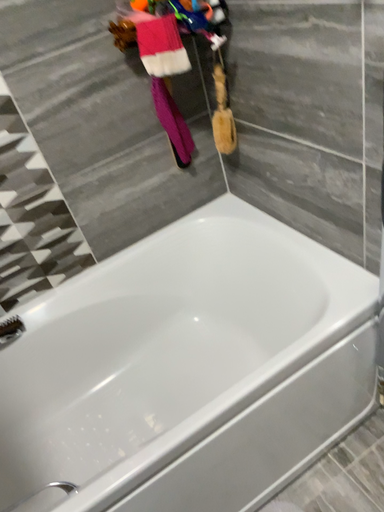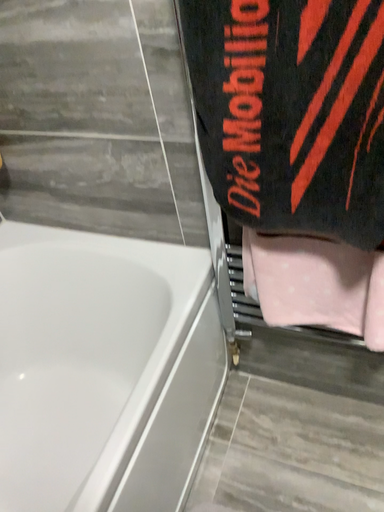
Question: Which way did the camera rotate in the video?

Choices:
 (A) rotated downward
 (B) rotated upward

Answer: (B)